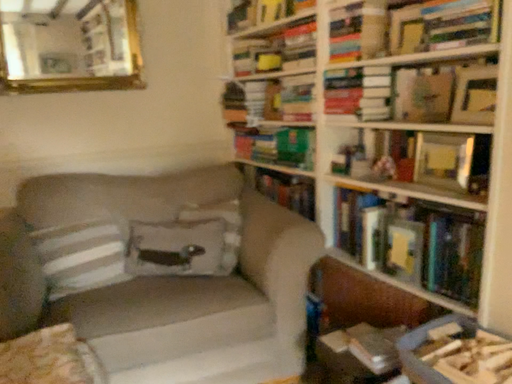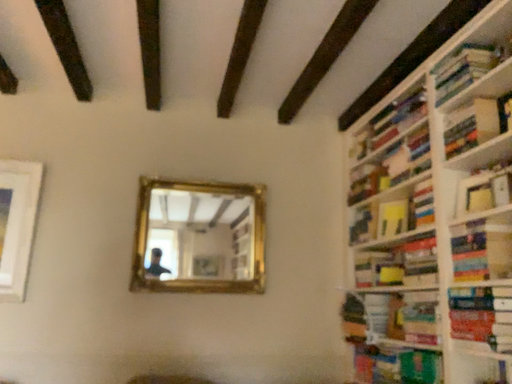
Question: How did the camera likely rotate when shooting the video?

Choices:
 (A) rotated downward
 (B) rotated upward

Answer: (B)